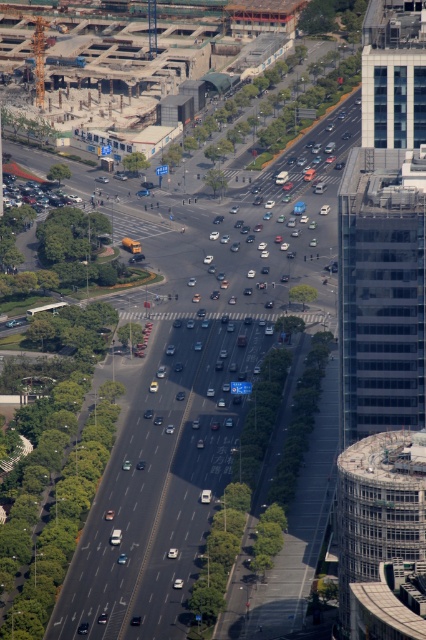
Question: Which object appears farthest from the camera in this image?

Choices:
 (A) glassy blue skyscraper at upper right
 (B) concrete textured building at right
 (C) transparent glass skyscraper at right

Answer: (A)

Question: Is glassy blue skyscraper at upper right further to the viewer compared to matte black car at left?

Choices:
 (A) yes
 (B) no

Answer: (A)

Question: Can you confirm if concrete textured building at right is smaller than glassy blue skyscraper at upper right?

Choices:
 (A) yes
 (B) no

Answer: (B)

Question: Among these points, which one is farthest from the camera?

Choices:
 (A) (13, 179)
 (B) (345, 576)

Answer: (B)

Question: Is concrete textured building at right below matte black car at left?

Choices:
 (A) yes
 (B) no

Answer: (A)

Question: Among these points, which one is nearest to the camera?

Choices:
 (A) (400, 605)
 (B) (28, 193)
 (C) (420, 56)
 (D) (345, 392)

Answer: (D)